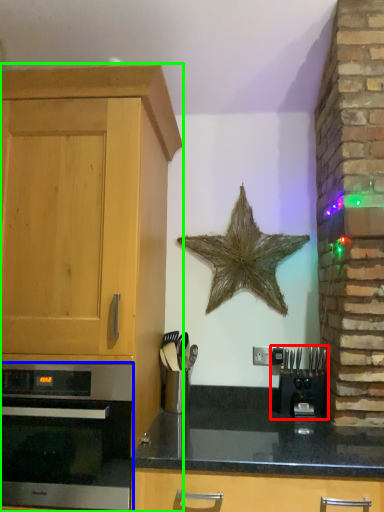
Question: Which object is positioned farthest from coffee machine (highlighted by a red box)? Select from oven (highlighted by a blue box) and cabinetry (highlighted by a green box).

Choices:
 (A) oven
 (B) cabinetry

Answer: (B)